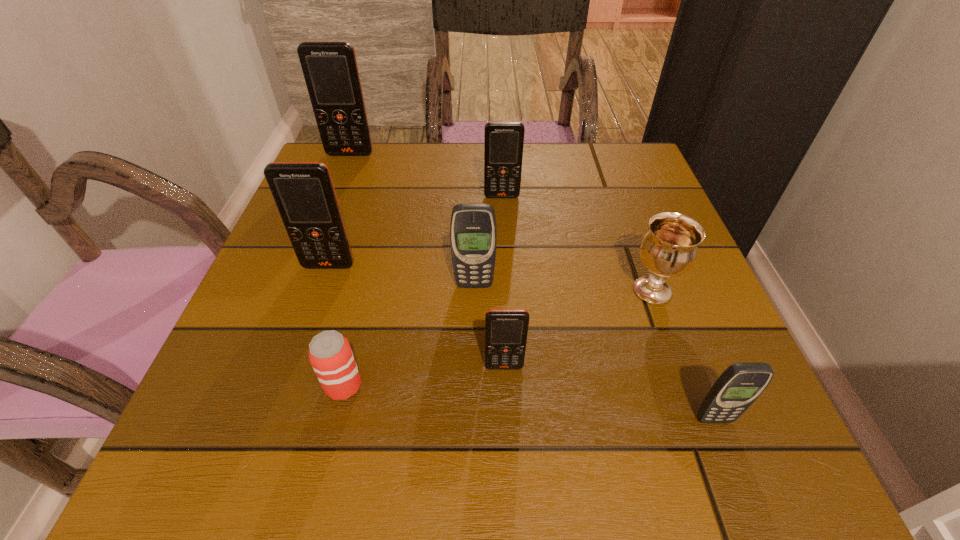
Find the location of a particular element. This screenshot has height=540, width=960. object that stands as the third closest to the fifth nearest cellular telephone is located at coordinates (304, 193).

Image resolution: width=960 pixels, height=540 pixels. I want to click on the third closest object to the chalice, so click(473, 233).

Select which cellular telephone appears as the third closest to the nearest orange cellular telephone. Please provide its 2D coordinates. Your answer should be formatted as a tuple, i.e. [(x, y)], where the tuple contains the x and y coordinates of a point satisfying the conditions above.

[(304, 193)]

Locate an element on the screen. the fourth closest cellular telephone to the second biggest orange cellular telephone is located at coordinates (330, 69).

You are a GUI agent. You are given a task and a screenshot of the screen. Output one action in this format:
    pyautogui.click(x=<x>, y=<y>)
    Task: Click on the orange cellular telephone that is the nearest to the nearest object
    
    Given the screenshot: What is the action you would take?
    pyautogui.click(x=506, y=330)

I want to click on orange cellular telephone that can be found as the second closest to the smallest orange cellular telephone, so click(503, 141).

Where is `vacant area that satisfies the following two spatial constraints: 1. on the screen of the farthest object; 2. on the right side of the chalice`? vacant area that satisfies the following two spatial constraints: 1. on the screen of the farthest object; 2. on the right side of the chalice is located at coordinates (297, 291).